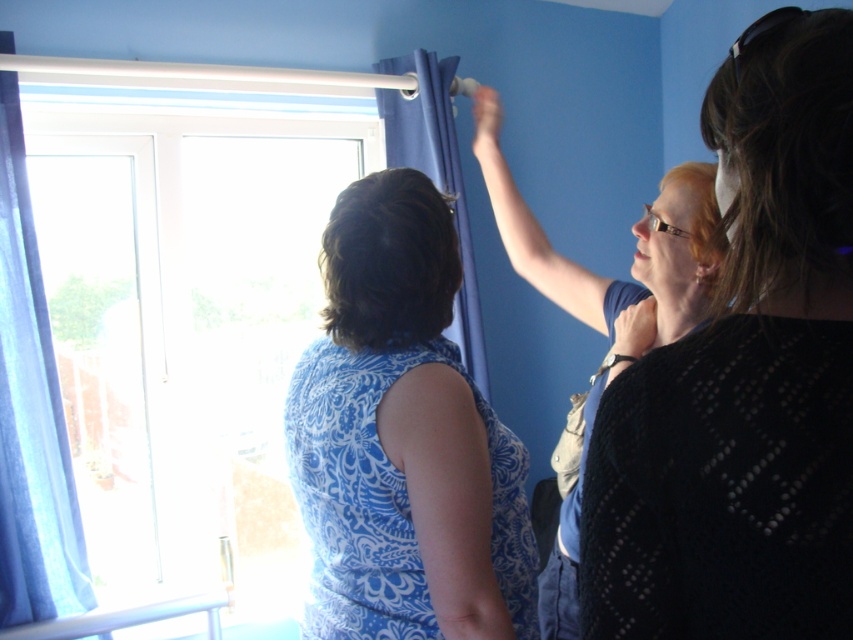
Based on the photo, you are a delivery person standing at the entrance of the room. You need to place a package that is 5 feet long between the matte blue dress at upper center and the blue fabric curtain at left. Is there enough space to place the package horizontally between them?

The distance between the matte blue dress at upper center and the blue fabric curtain at left is 4.05 feet, which is shorter than the 5 feet length of the package. Therefore, there is not enough space to place the package horizontally between them.

You are organizing a clothing display in a store and need to arrange the blue printed dress at center and the matte blue dress at upper center. Given their sizes, which dress should be placed in a smaller display area and which in a larger one?

The blue printed dress at center occupies less space than the matte blue dress at upper center, so the blue printed dress at center should be placed in the smaller display area and the matte blue dress at upper center in the larger one.

You are standing at the point labeled point (x=546, y=589). You want to walk to the door located at point (x=418, y=195). Is there a clear path between these two points without needing to go around any obstacles?

Yes, there is a clear path between point (x=546, y=589) and point (x=418, y=195) because point (x=418, y=195) is in front of point (x=546, y=589), indicating no obstacles block the direct route between them.